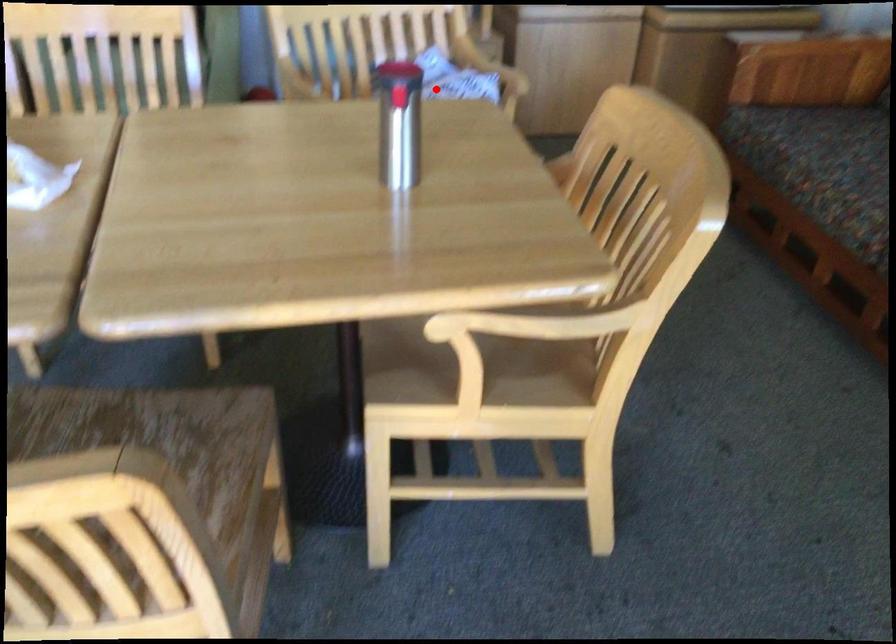
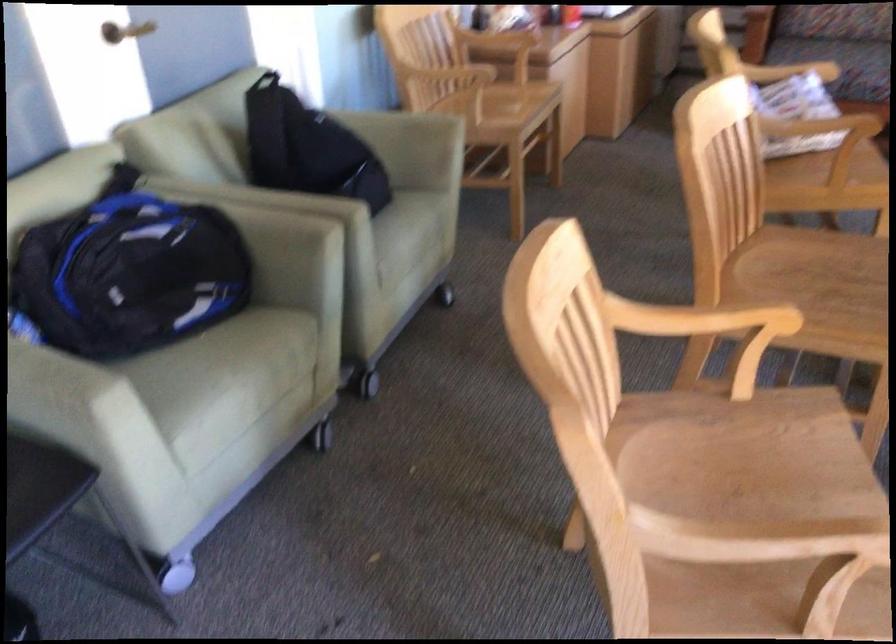
Question: A red point is marked in image1. In image2, is the corresponding 3D point closer to the camera or farther? Reply with the corresponding letter.

Choices:
 (A) The corresponding 3D point is closer.
 (B) The corresponding 3D point is farther.

Answer: (B)